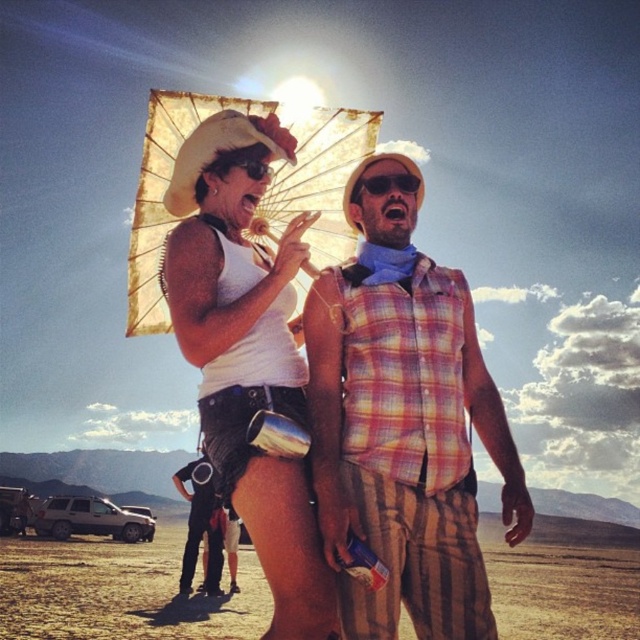
Question: Among these objects, which one is farthest from the camera?

Choices:
 (A) matte white umbrella at upper center
 (B) dirt field at lower center
 (C) gold paper parasol at upper center
 (D) plaid fabric shirt at center

Answer: (B)

Question: Does matte white umbrella at upper center appear over gold paper parasol at upper center?

Choices:
 (A) yes
 (B) no

Answer: (B)

Question: Which object is farther from the camera taking this photo?

Choices:
 (A) matte white umbrella at upper center
 (B) brushed metal canteen at center
 (C) plaid fabric shirt at center

Answer: (B)

Question: Can you confirm if dirt field at lower center is positioned below brushed metal canteen at center?

Choices:
 (A) no
 (B) yes

Answer: (B)

Question: Is plaid fabric shirt at center closer to the viewer compared to matte white umbrella at upper center?

Choices:
 (A) yes
 (B) no

Answer: (B)

Question: Among these points, which one is nearest to the camera?

Choices:
 (A) (259, 544)
 (B) (627, 548)
 (C) (164, 108)

Answer: (A)